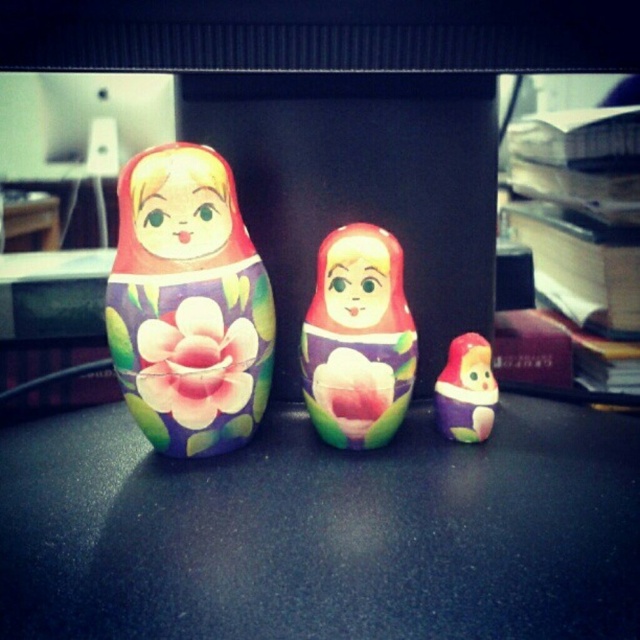
Question: Which point is closer to the camera?

Choices:
 (A) matte painted doll at left
 (B) matte purple doll at lower right
 (C) matte painted doll at center
 (D) floral matte painting at center

Answer: (A)

Question: Is matte painted doll at left below floral matte painting at center?

Choices:
 (A) yes
 (B) no

Answer: (B)

Question: Is matte black table at center above matte painted doll at left?

Choices:
 (A) yes
 (B) no

Answer: (B)

Question: Which of the following is the farthest from the observer?

Choices:
 (A) (196, 173)
 (B) (362, 413)

Answer: (B)

Question: Is matte painted doll at left above matte painted doll at center?

Choices:
 (A) yes
 (B) no

Answer: (A)

Question: Which of the following is the closest to the observer?

Choices:
 (A) (484, 401)
 (B) (150, 394)
 (C) (336, 301)
 (D) (237, 540)

Answer: (D)